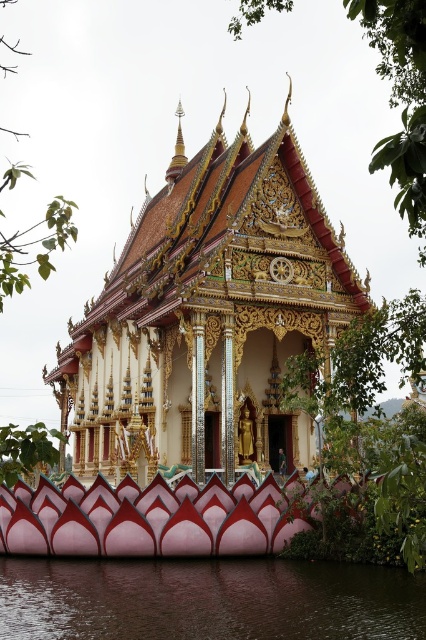
Locate an element on the screen. gold/gilded wood palace at center is located at coordinates (207, 316).

Between gold/gilded wood palace at center and brown smooth water at lower center, which one is positioned higher?

gold/gilded wood palace at center

Identify the location of gold/gilded wood palace at center. Image resolution: width=426 pixels, height=640 pixels. (207, 316).

Find the location of a particular element. gold/gilded wood palace at center is located at coordinates (207, 316).